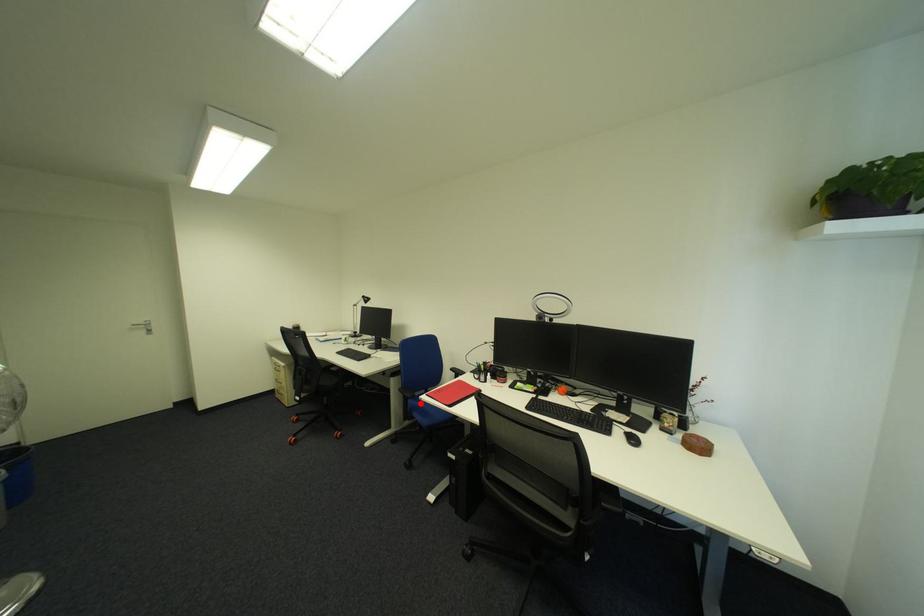
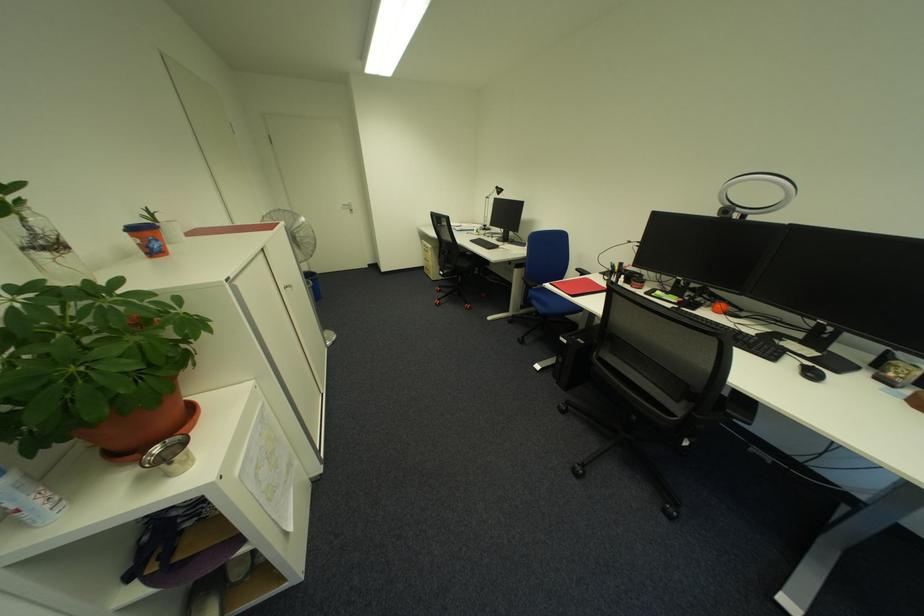
Locate, in the second image, the point that corresponds to the highlighted location in the first image.

(541, 293)